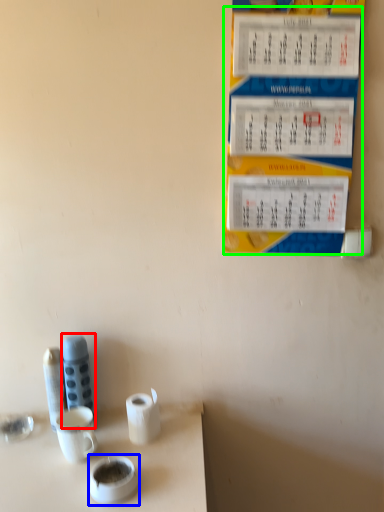
Question: Based on their relative distances, which object is nearer to stationery (highlighted by a red box)? Choose from teacup (highlighted by a blue box) and menu (highlighted by a green box).

Choices:
 (A) teacup
 (B) menu

Answer: (A)